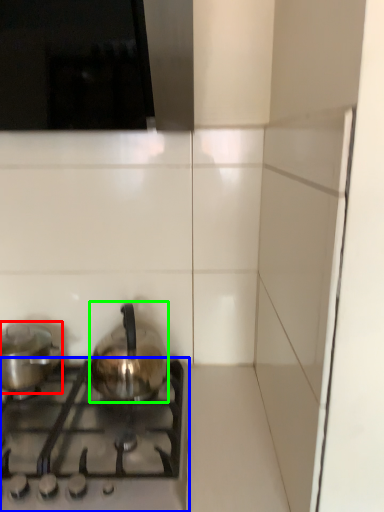
Question: Based on their relative distances, which object is nearer to kitchen appliance (highlighted by a red box)? Choose from gas stove (highlighted by a blue box) and kitchen appliance (highlighted by a green box).

Choices:
 (A) gas stove
 (B) kitchen appliance

Answer: (B)